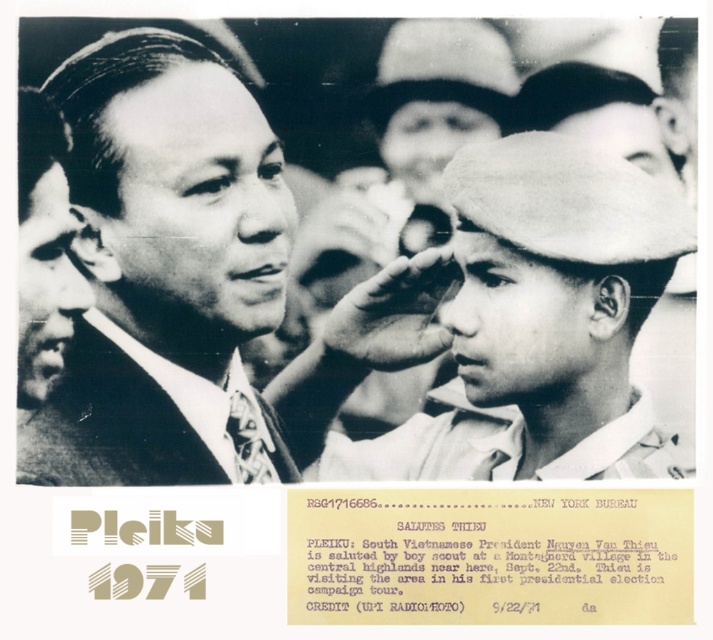
Question: In this image, where is smooth black suit at center located relative to white felt hat at center?

Choices:
 (A) left
 (B) right

Answer: (A)

Question: Which object is farther from the camera taking this photo?

Choices:
 (A) patterned fabric tie at left
 (B) smooth black suit at center
 (C) white cotton shirt at center
 (D) white felt hat at center

Answer: (C)

Question: Estimate the real-world distances between objects in this image. Which object is farther from the smooth black suit at center?

Choices:
 (A) white felt hat at center
 (B) white cotton shirt at center

Answer: (A)

Question: Is white felt hat at center closer to camera compared to patterned fabric tie at left?

Choices:
 (A) no
 (B) yes

Answer: (B)

Question: Among these points, which one is farthest from the camera?

Choices:
 (A) (179, 298)
 (B) (394, 436)
 (C) (502, 381)
 (D) (103, 477)

Answer: (B)

Question: Is smooth black suit at center wider than patterned fabric tie at left?

Choices:
 (A) yes
 (B) no

Answer: (B)